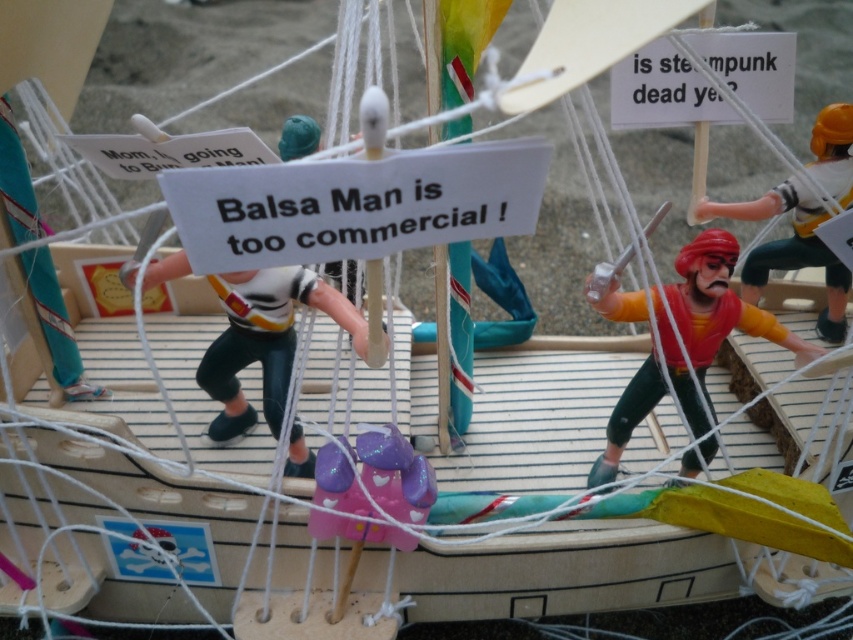
Question: Is white paper sign at upper right positioned in front of purple glittery toy at center?

Choices:
 (A) no
 (B) yes

Answer: (A)

Question: Which object is farther from the camera taking this photo?

Choices:
 (A) matte red pirate at center right
 (B) shiny plastic pirate at center
 (C) white paper sign at upper right
 (D) white paper sign at center

Answer: (A)

Question: In this image, where is white plastic figure at center located relative to matte red pirate at center right?

Choices:
 (A) right
 (B) left

Answer: (B)

Question: Can you confirm if white plastic figure at center is positioned below white paper sign at upper right?

Choices:
 (A) yes
 (B) no

Answer: (A)

Question: Which point is closer to the camera taking this photo?

Choices:
 (A) (711, 58)
 (B) (758, 336)
 (C) (230, 289)

Answer: (C)

Question: Which point appears farthest from the camera in this image?

Choices:
 (A) (670, 115)
 (B) (329, 460)
 (C) (347, 179)
 (D) (281, 385)

Answer: (A)